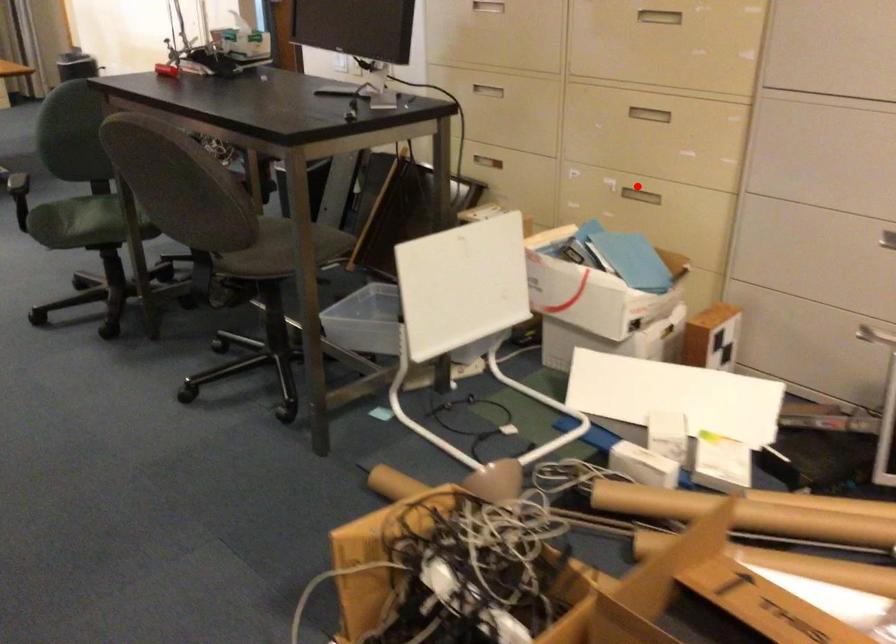
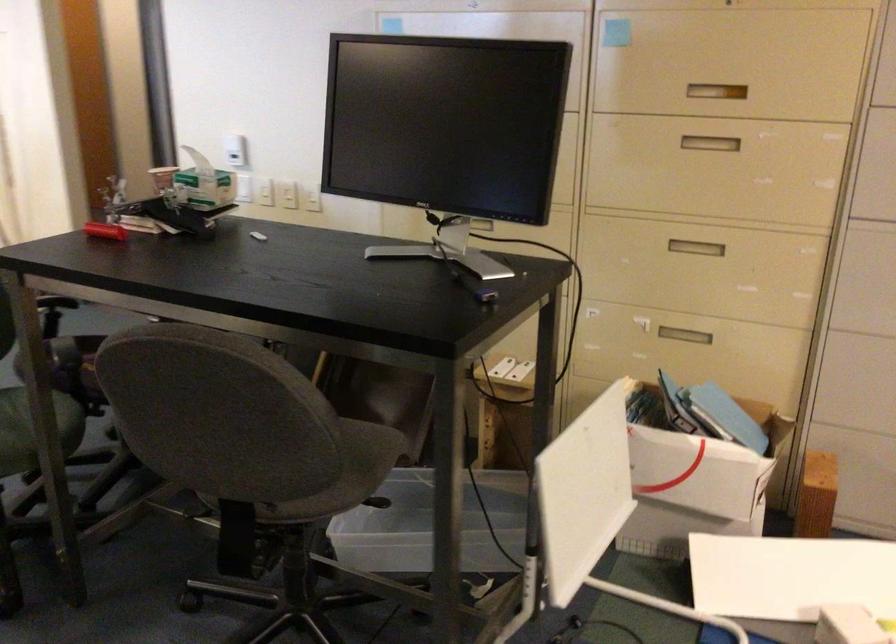
Find the pixel in the second image that matches the highlighted location in the first image.

(685, 330)